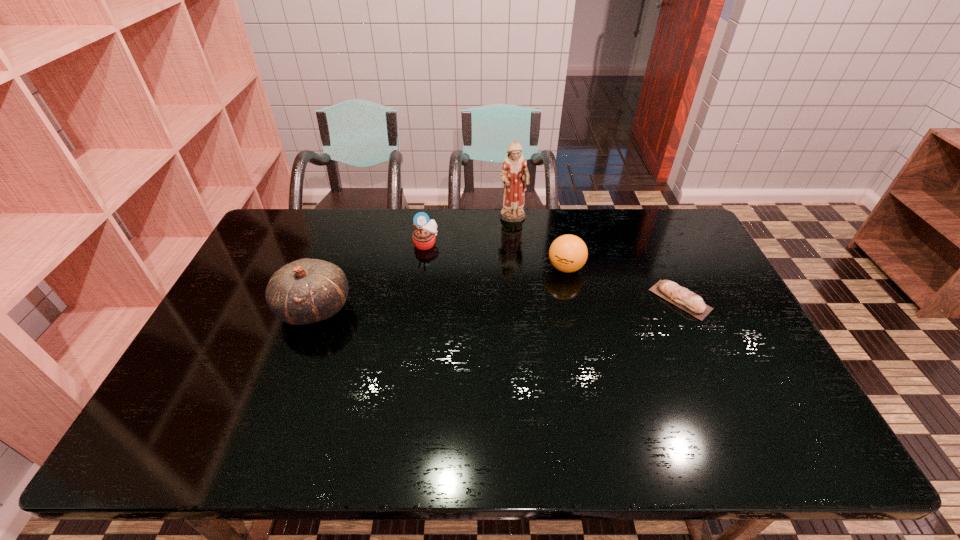
The height and width of the screenshot is (540, 960). Identify the location of vacant region between the gourd and the rightmost object. (497, 304).

The width and height of the screenshot is (960, 540). Identify the location of free space between the leftmost object and the rightmost object. (497, 304).

I want to click on vacant area that lies between the rightmost object and the leftmost object, so click(497, 304).

Image resolution: width=960 pixels, height=540 pixels. In order to click on vacant point located between the farthest object and the second farthest object in this screenshot , I will do `click(469, 232)`.

Locate an element on the screen. Image resolution: width=960 pixels, height=540 pixels. free space between the shortest object and the second object from right to left is located at coordinates (623, 284).

You are a GUI agent. You are given a task and a screenshot of the screen. Output one action in this format:
    pyautogui.click(x=<x>, y=<y>)
    Task: Click on the free space between the muffin and the fourth object from left to right
    The width and height of the screenshot is (960, 540).
    Given the screenshot: What is the action you would take?
    pyautogui.click(x=495, y=256)

Where is `free point between the fourth nearest object and the second object from right to left`? This screenshot has height=540, width=960. free point between the fourth nearest object and the second object from right to left is located at coordinates (495, 256).

Identify the location of free space between the fourth nearest object and the third object from right to left. (469, 232).

Locate an element on the screen. The width and height of the screenshot is (960, 540). unoccupied position between the pita bread and the second farthest object is located at coordinates (553, 272).

This screenshot has width=960, height=540. Identify the location of the closest object relative to the leftmost object. (424, 235).